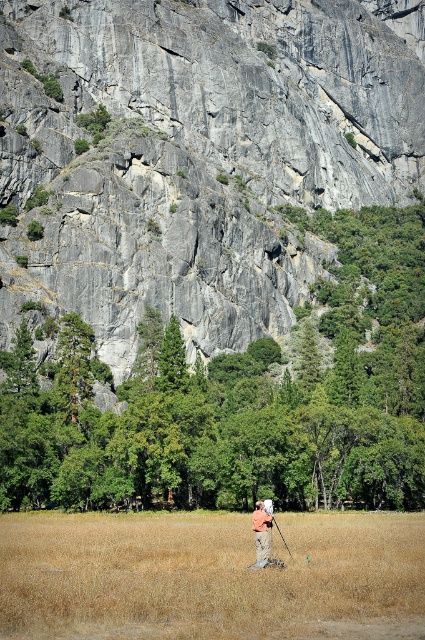
You are a photographer setting up equipment in the field. You have a black matte tripod at center and are wearing camouflage pants at center. If you want to ensure your pants don not block the tripod, should you move left or right?

The camouflage pants at center are to the left of the black matte tripod at center. To avoid blocking the tripod, you should move to the right.

You are standing at the origin point of the image coordinate system. The image coordinate system has the origin at the bottom left corner. You want to walk to the brown dry grass at center. In which direction should you move? Please answer with either up, down, left, or right.

The brown dry grass at center is located at point 0.902 on the x axis and 0.494 on the y axis. Since the origin is at the bottom left corner, moving right increases the x coordinate and moving up increases the y coordinate. To reach the grass at x 0.902, you should move right.